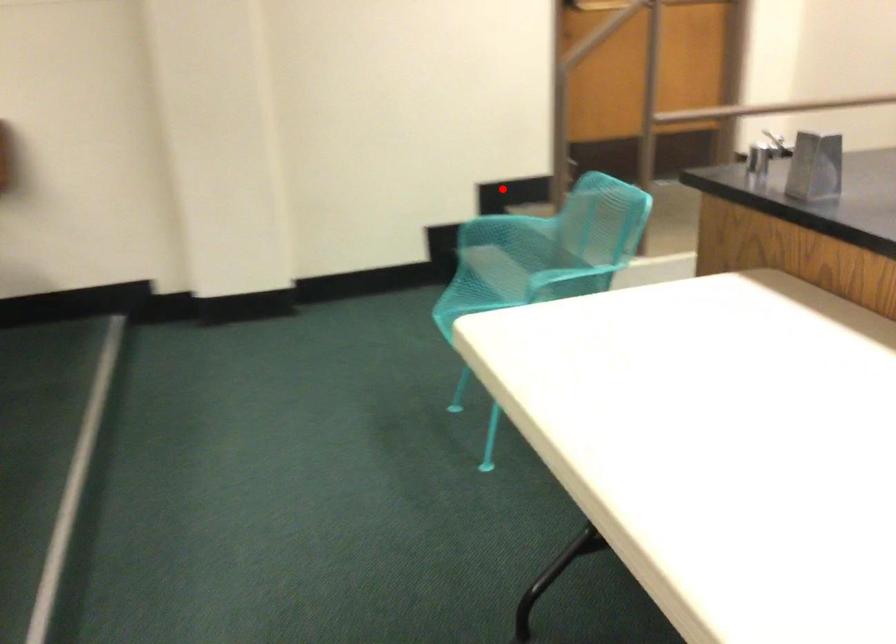
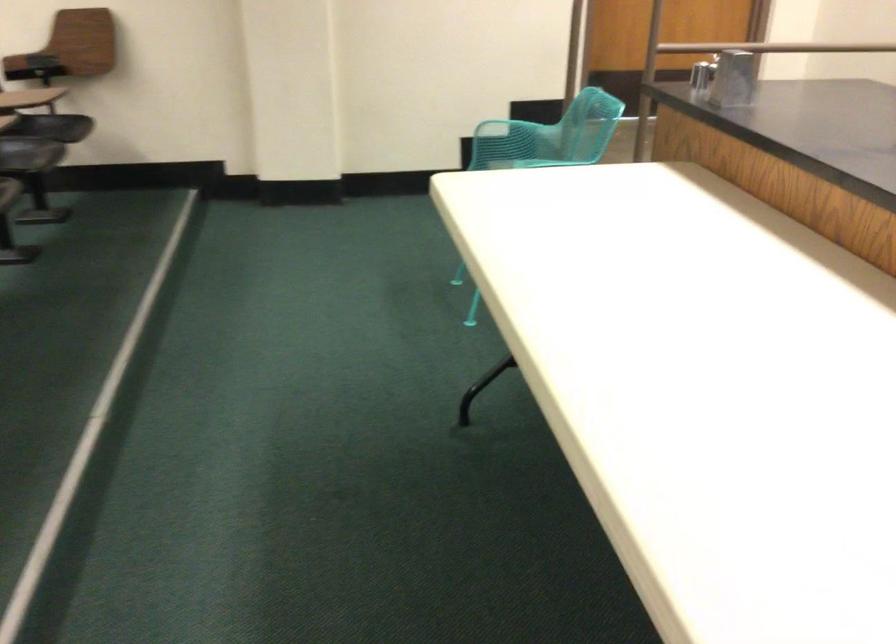
Question: I am providing you with two images of the same scene from different viewpoints. A red point is marked on the first image. Can you still see the location of the red point in image 2?

Choices:
 (A) Yes
 (B) No

Answer: (A)